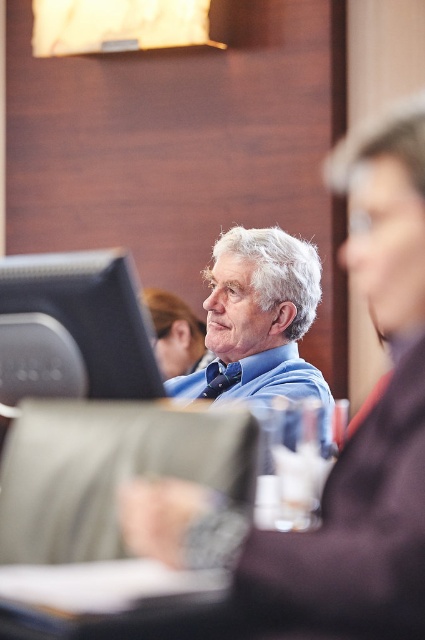
Question: Is blue shirt at center to the left of matte black hair at upper center from the viewer's perspective?

Choices:
 (A) no
 (B) yes

Answer: (A)

Question: Can you confirm if blue shirt at center is positioned to the left of matte black hair at upper center?

Choices:
 (A) yes
 (B) no

Answer: (B)

Question: Considering the relative positions of blue shirt at center and matte black hair at upper center in the image provided, where is blue shirt at center located with respect to matte black hair at upper center?

Choices:
 (A) left
 (B) right

Answer: (B)

Question: Among these points, which one is farthest from the camera?

Choices:
 (A) (184, 342)
 (B) (34, 268)
 (C) (257, 310)

Answer: (A)

Question: Which point appears farthest from the camera in this image?

Choices:
 (A) (159, 352)
 (B) (274, 232)
 (C) (121, 316)

Answer: (A)

Question: Which of the following is the farthest from the observer?

Choices:
 (A) (93, 276)
 (B) (156, 289)
 (C) (286, 273)

Answer: (B)